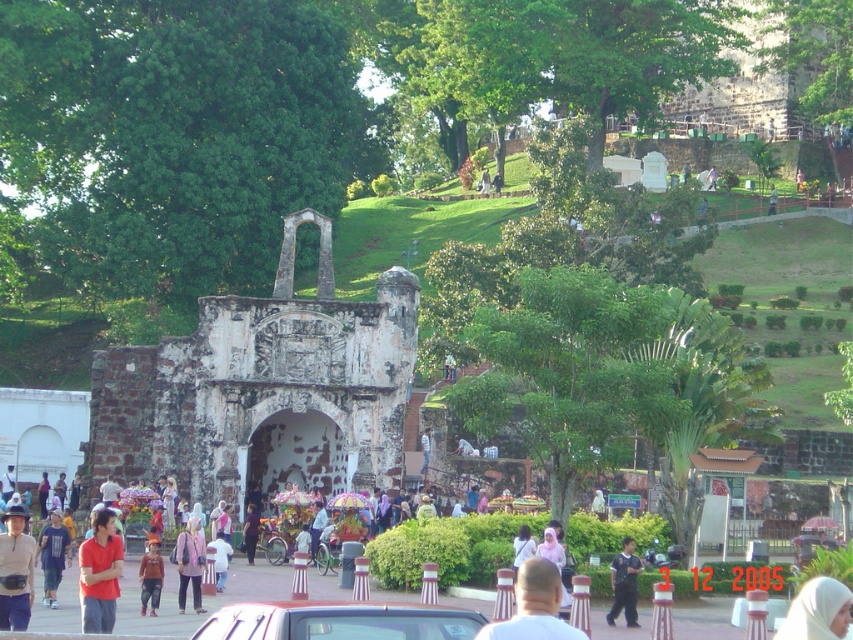
Who is more distant from viewer, [405,627] or [825,609]?

Point [825,609]

Is metallic silver car at center smaller than white fabric headscarf at center?

Incorrect, metallic silver car at center is not smaller in size than white fabric headscarf at center.

The height and width of the screenshot is (640, 853). I want to click on metallic silver car at center, so click(x=339, y=621).

Is matte red shirt at center smaller than matte brown shirt at center?

Indeed, matte red shirt at center has a smaller size compared to matte brown shirt at center.

Which is in front, point (83, 602) or point (13, 515)?

Point (83, 602)

The width and height of the screenshot is (853, 640). What are the coordinates of `matte red shirt at center` in the screenshot? It's located at (99, 573).

Who is taller, white fabric headscarf at center or matte purple shirt at center?

Standing taller between the two is white fabric headscarf at center.

You are a GUI agent. You are given a task and a screenshot of the screen. Output one action in this format:
    pyautogui.click(x=<x>, y=<y>)
    Task: Click on the white fabric headscarf at center
    The height and width of the screenshot is (640, 853).
    Given the screenshot: What is the action you would take?
    pyautogui.click(x=817, y=611)

Locate an element on the screen. white fabric headscarf at center is located at coordinates (817, 611).